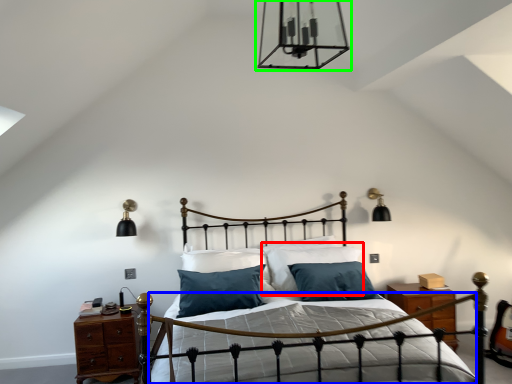
Question: Which is farther away from pillow (highlighted by a red box)? bed frame (highlighted by a blue box) or light fixture (highlighted by a green box)?

Choices:
 (A) bed frame
 (B) light fixture

Answer: (B)